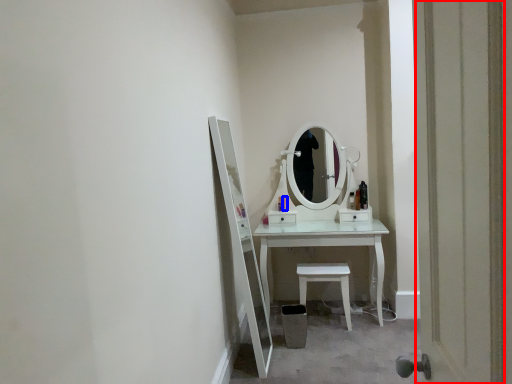
Question: Which object appears closest to the camera in this image, door (highlighted by a red box) or toiletry (highlighted by a blue box)?

Choices:
 (A) door
 (B) toiletry

Answer: (A)